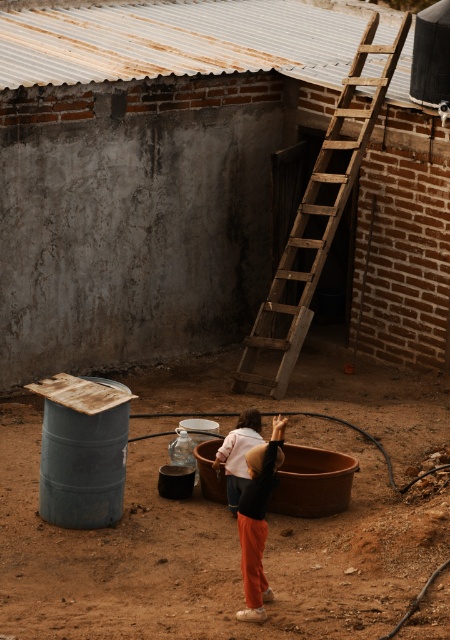
Based on the photo, you are standing in the rustic outdoor scene and notice a brown dirt field at center and a matte black shirt at center. Which object is positioned lower in the image?

The brown dirt field at center is positioned below the matte black shirt at center, so it is lower in the image.

Based on the scene description, where is the brown dirt field at center located in terms of coordinates?

The brown dirt field at center is located at coordinates point (211,552).

You are a painter carrying a 1.2 meter wide painting. You need to move it through the space between the rusty metal ladder at upper center and the wooden at right. Can the painting fit through the space?

The rusty metal ladder at upper center is narrower than the wooden at right. The space between them is determined by the ladder and the wooden object. Since the ladder is narrower, the minimum width between them would be the ladder width. However, since the ladder is less than the wooden object, the space between them may be sufficient. But without exact measurements, it is unclear. However, the description states that the ladder is narrower than the wooden object. If the painting is 1.2 meters wide, and if